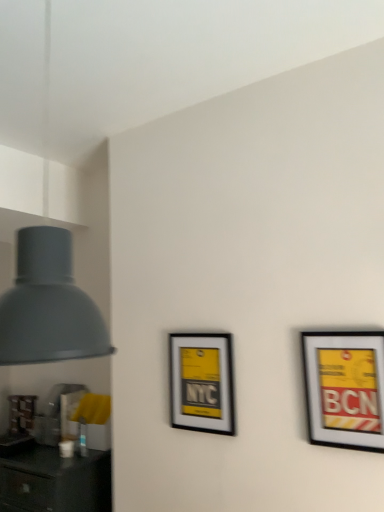
Question: From a real-world perspective, is matte black picture frame at right, acting as the first picture frame starting from the front, positioned over matte gray lampshade at left based on gravity?

Choices:
 (A) yes
 (B) no

Answer: (B)

Question: Can you confirm if matte black picture frame at right, acting as the second picture frame starting from the back, is thinner than matte gray lampshade at left?

Choices:
 (A) yes
 (B) no

Answer: (B)

Question: Can you confirm if matte black picture frame at right, acting as the first picture frame starting from the front, is wider than matte gray lampshade at left?

Choices:
 (A) yes
 (B) no

Answer: (A)

Question: From the image's perspective, would you say matte black picture frame at right, acting as the first picture frame starting from the front, is shown under matte gray lampshade at left?

Choices:
 (A) no
 (B) yes

Answer: (B)

Question: Could you tell me if matte black picture frame at right, acting as the first picture frame starting from the front, is facing matte gray lampshade at left?

Choices:
 (A) yes
 (B) no

Answer: (B)

Question: Is matte black picture frame at right, the 2th picture frame in the left-to-right sequence, positioned before matte gray lampshade at left?

Choices:
 (A) yes
 (B) no

Answer: (B)

Question: Does matte gray lampshade at left have a lesser height compared to matte black picture frame at center, which ranks as the first picture frame in back-to-front order?

Choices:
 (A) no
 (B) yes

Answer: (A)

Question: From a real-world perspective, is matte gray lampshade at left beneath matte black picture frame at center, which ranks as the 1th picture frame in left-to-right order?

Choices:
 (A) no
 (B) yes

Answer: (A)

Question: Can you confirm if matte gray lampshade at left is smaller than matte black picture frame at center, the second picture frame positioned from the right?

Choices:
 (A) yes
 (B) no

Answer: (B)

Question: Is matte gray lampshade at left with matte black picture frame at center, which ranks as the first picture frame in back-to-front order?

Choices:
 (A) yes
 (B) no

Answer: (B)

Question: From a real-world perspective, is matte gray lampshade at left on matte black picture frame at center, the second picture frame positioned from the front?

Choices:
 (A) yes
 (B) no

Answer: (A)

Question: Is matte gray lampshade at left facing away from matte black picture frame at center, the second picture frame positioned from the right?

Choices:
 (A) yes
 (B) no

Answer: (B)

Question: Could you tell me if matte gray lampshade at left is facing matte black picture frame at right, the 2th picture frame in the left-to-right sequence?

Choices:
 (A) yes
 (B) no

Answer: (B)